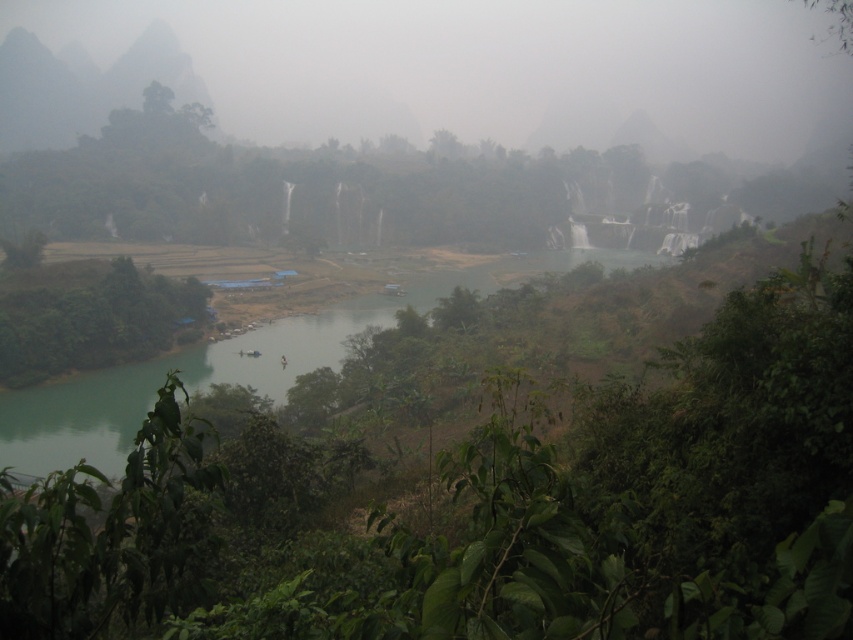
You are an explorer trying to determine the tallest object in the scene. Based on the green leafy tree at center and the gray rock mountain at upper left, which one is taller?

The gray rock mountain at upper left is taller than the green leafy tree at center.

You are a hiker trying to navigate through the dense vegetation in the foreground. You see the green leafy tree at center and the green leafy tree at lower left. Which tree would block your path more if you were moving straight ahead?

The green leafy tree at center would block your path more because it has a larger size compared to the green leafy tree at lower left.